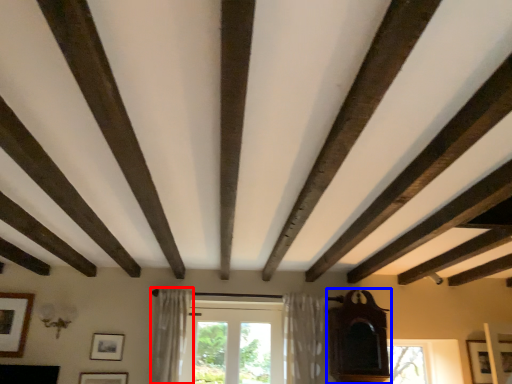
Question: Which object appears farthest to the camera in this image, curtain (highlighted by a red box) or furniture (highlighted by a blue box)?

Choices:
 (A) curtain
 (B) furniture

Answer: (B)